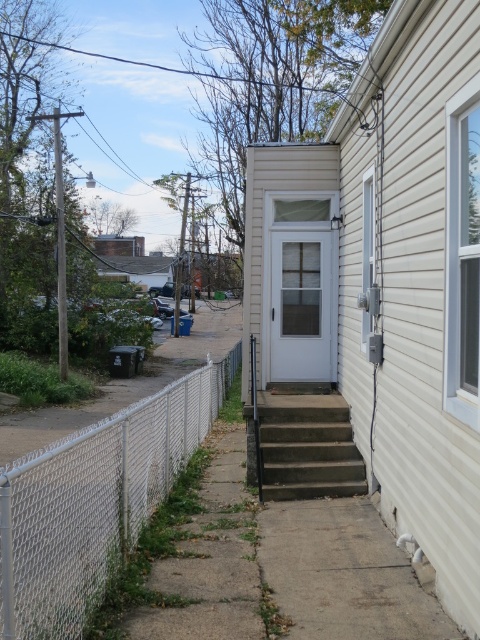
Who is taller, concrete/steps at lower center or white glass door at center?

Standing taller between the two is white glass door at center.

Locate an element on the screen. concrete/steps at lower center is located at coordinates (308, 448).

What do you see at coordinates (95, 500) in the screenshot? Image resolution: width=480 pixels, height=640 pixels. I see `white chain-link fence at lower left` at bounding box center [95, 500].

Does white chain-link fence at lower left come behind concrete/steps at lower center?

That is False.

What are the coordinates of `white chain-link fence at lower left` in the screenshot? It's located at (95, 500).

Between concrete sidewalk at lower center and concrete/steps at lower center, which one is positioned higher?

Positioned higher is concrete/steps at lower center.

How far apart are concrete sidewalk at lower center and concrete/steps at lower center?

37.59 inches

Between point (278, 525) and point (321, 493), which one is positioned behind?

The point (321, 493) is behind.

This screenshot has width=480, height=640. Find the location of `concrete sidewalk at lower center`. concrete sidewalk at lower center is located at coordinates (287, 568).